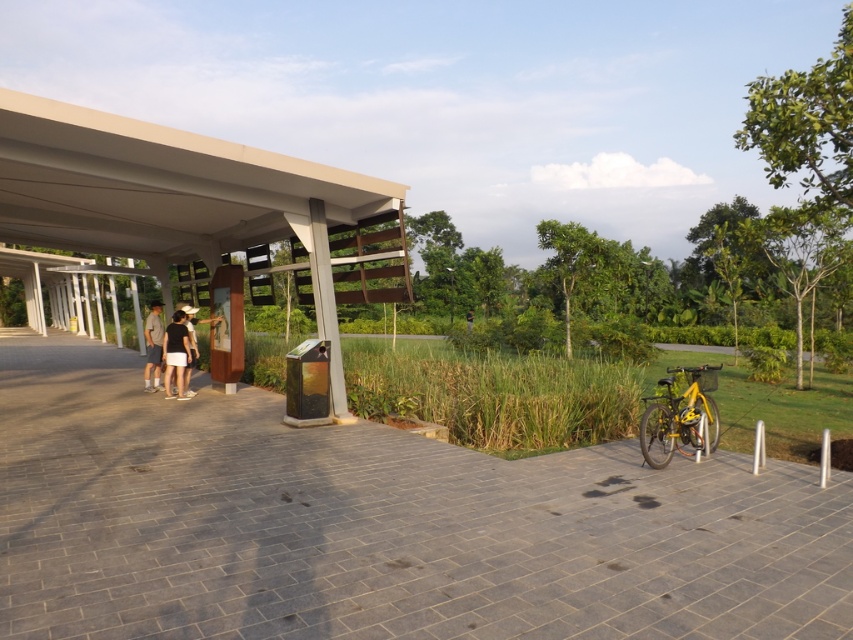
Is gray brick path at center bigger than matte white pergola at center?

No.

Between gray brick path at center and matte white pergola at center, which one is positioned higher?

matte white pergola at center

Is point (395, 440) positioned after point (225, 177)?

No, (395, 440) is closer to viewer.

Where is `gray brick path at center`? gray brick path at center is located at coordinates (379, 524).

Between black matte shorts at center and gray cotton shorts at left, which one has less height?

Standing shorter between the two is black matte shorts at center.

Is point (165, 390) behind point (148, 390)?

No.

Is point (173, 323) in front of point (148, 337)?

Yes, point (173, 323) is closer to viewer.

The image size is (853, 640). Identify the location of black matte shorts at center. (177, 353).

Is gray brick path at center taller than gray cotton shorts at left?

No, gray brick path at center is not taller than gray cotton shorts at left.

Measure the distance between gray brick path at center and gray cotton shorts at left.

6.00 meters

Is point (350, 504) farther from camera compared to point (146, 356)?

No, it is in front of (146, 356).

In order to click on gray brick path at center in this screenshot , I will do `click(379, 524)`.